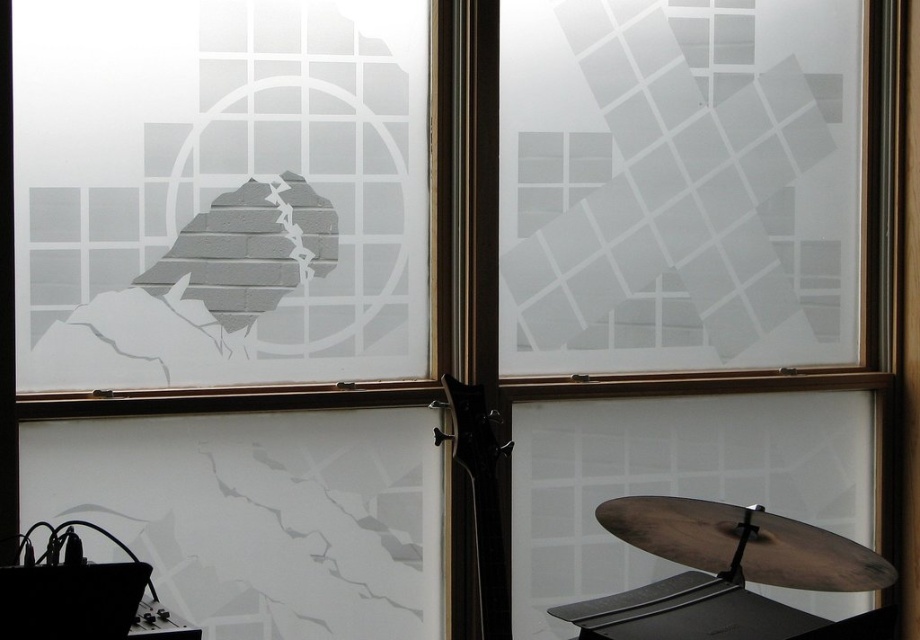
Question: Among these points, which one is farthest from the camera?

Choices:
 (A) (452, 406)
 (B) (322, 296)

Answer: (B)

Question: Observing the image, what is the correct spatial positioning of frosted glass window at upper left in reference to glossy black guitar at center?

Choices:
 (A) above
 (B) below

Answer: (A)

Question: Which point is closer to the camera taking this photo?

Choices:
 (A) (450, 385)
 (B) (72, 148)

Answer: (A)

Question: Does frosted glass window at upper left have a greater width compared to glossy black guitar at center?

Choices:
 (A) yes
 (B) no

Answer: (A)

Question: From the image, what is the correct spatial relationship of frosted glass window at upper left in relation to glossy black guitar at center?

Choices:
 (A) below
 (B) above

Answer: (B)